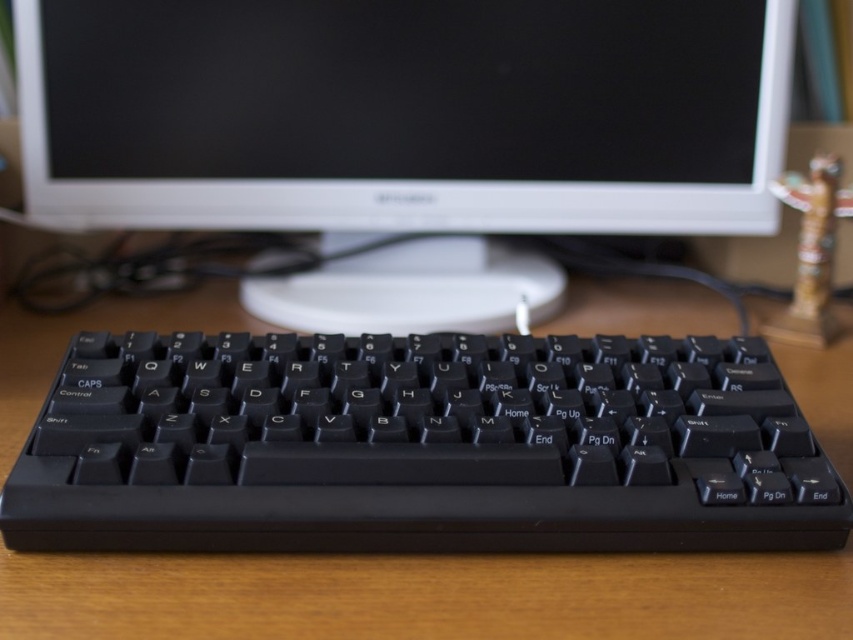
Question: Which point is farther from the camera taking this photo?

Choices:
 (A) tap(701, 12)
 (B) tap(566, 419)

Answer: (A)

Question: Which object appears farthest from the camera in this image?

Choices:
 (A) black matte monitor at upper center
 (B) black plastic keyboard at center

Answer: (A)

Question: Which of the following is the farthest from the observer?

Choices:
 (A) black plastic keyboard at center
 (B) black matte monitor at upper center

Answer: (B)

Question: Is black matte monitor at upper center wider than black plastic keyboard at center?

Choices:
 (A) yes
 (B) no

Answer: (A)

Question: Does black matte monitor at upper center have a greater width compared to black plastic keyboard at center?

Choices:
 (A) no
 (B) yes

Answer: (B)

Question: Is black matte monitor at upper center to the left of black plastic keyboard at center from the viewer's perspective?

Choices:
 (A) no
 (B) yes

Answer: (B)